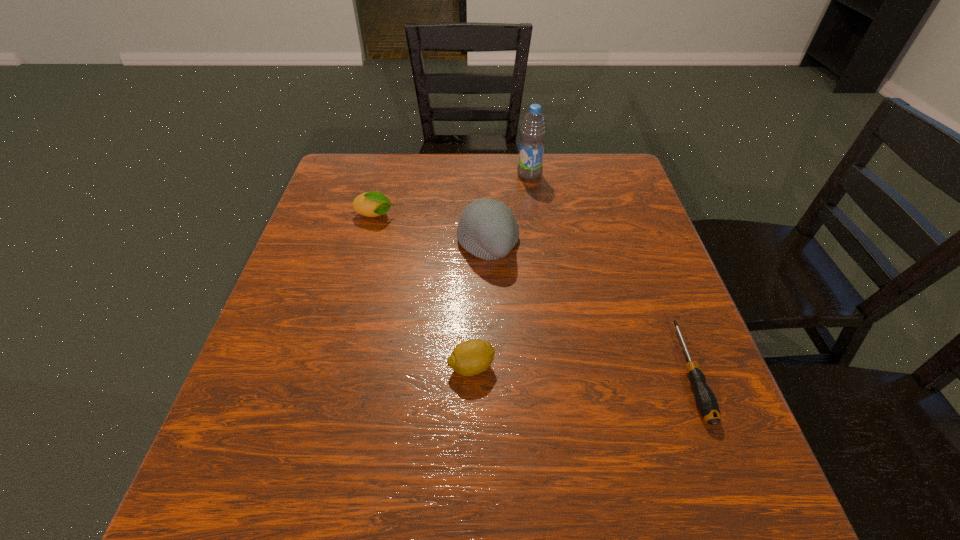
Where is `blank space located 0.380m on the front of the beanie`? The image size is (960, 540). blank space located 0.380m on the front of the beanie is located at coordinates (492, 435).

Identify the location of vacant space located with leaves positioned above the leftmost object. (435, 216).

Identify the location of vacant space located 0.320m at the stem end of the nearer lemon. (668, 367).

Find the location of a particular element. This screenshot has height=540, width=960. vacant position located on the left of the shortest object is located at coordinates (592, 372).

What are the coordinates of `object located at the far edge` in the screenshot? It's located at (533, 130).

Locate an element on the screen. The height and width of the screenshot is (540, 960). object situated at the left edge is located at coordinates (371, 204).

What are the coordinates of `object that is at the right edge` in the screenshot? It's located at (706, 402).

Where is `blank space at the far edge of the desktop`? The height and width of the screenshot is (540, 960). blank space at the far edge of the desktop is located at coordinates (567, 195).

Locate an element on the screen. The width and height of the screenshot is (960, 540). vacant point at the near edge is located at coordinates (336, 486).

Where is `vacant region at the left edge of the desktop`? This screenshot has width=960, height=540. vacant region at the left edge of the desktop is located at coordinates (334, 281).